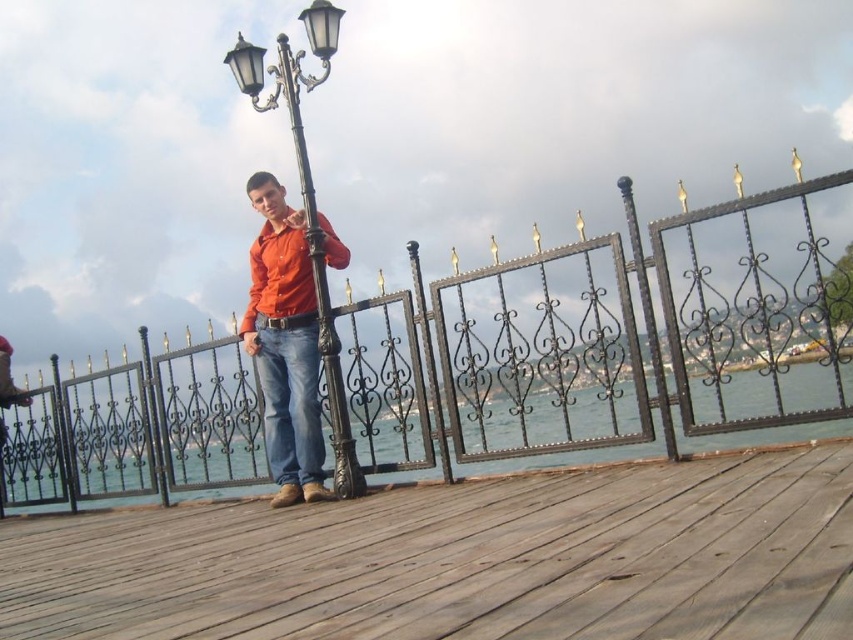
Question: Is black wrought iron fence at center in front of polished metal lamp post at center?

Choices:
 (A) yes
 (B) no

Answer: (A)

Question: From the image, what is the correct spatial relationship of black wrought iron fence at center in relation to denim at center?

Choices:
 (A) above
 (B) below

Answer: (B)

Question: Which point appears closest to the camera in this image?

Choices:
 (A) (21, 458)
 (B) (289, 52)
 (C) (231, 422)
 (D) (219, 520)

Answer: (D)

Question: Which point is closer to the camera?

Choices:
 (A) (321, 474)
 (B) (67, 394)
 (C) (335, 44)
 (D) (444, 525)

Answer: (D)

Question: Can you confirm if weathered wood deck at center is positioned to the right of blue water at center?

Choices:
 (A) yes
 (B) no

Answer: (A)

Question: Which object is the farthest from the blue water at center?

Choices:
 (A) polished metal lamp post at center
 (B) weathered wood deck at center
 (C) black wrought iron fence at center

Answer: (B)